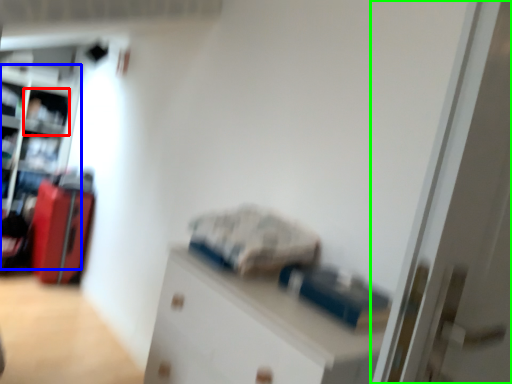
Question: Which object is the farthest from shelf (highlighted by a red box)? Choose among these: bookshelf (highlighted by a blue box) or door (highlighted by a green box).

Choices:
 (A) bookshelf
 (B) door

Answer: (B)